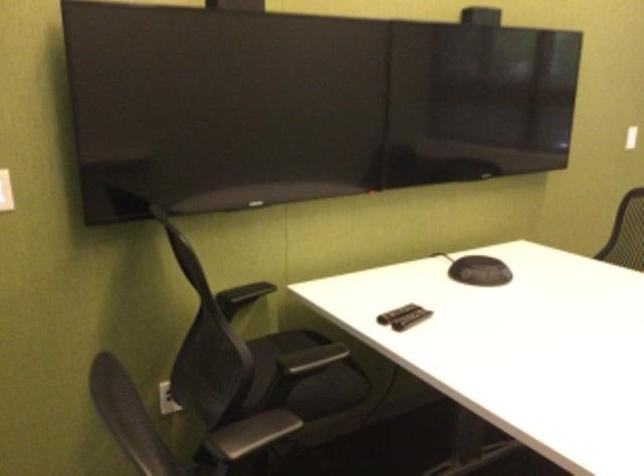
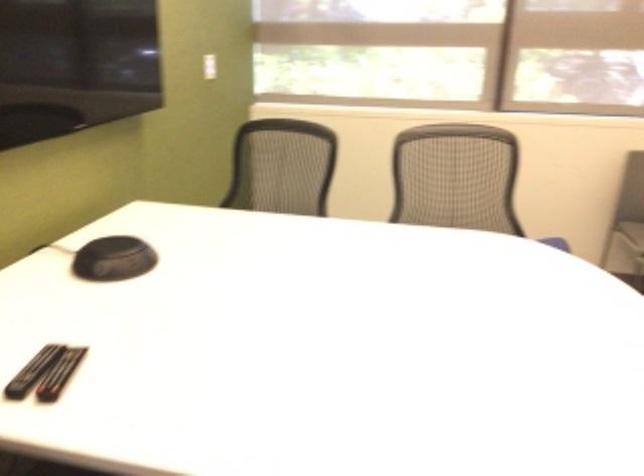
Question: How did the camera likely rotate?

Choices:
 (A) Left
 (B) Right
 (C) Up
 (D) Down

Answer: (B)